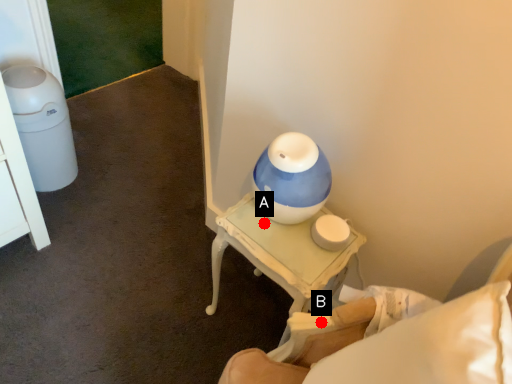
Question: Two points are circled on the image, labeled by A and B beside each circle. Which point is closer to the camera?

Choices:
 (A) A is closer
 (B) B is closer

Answer: (B)